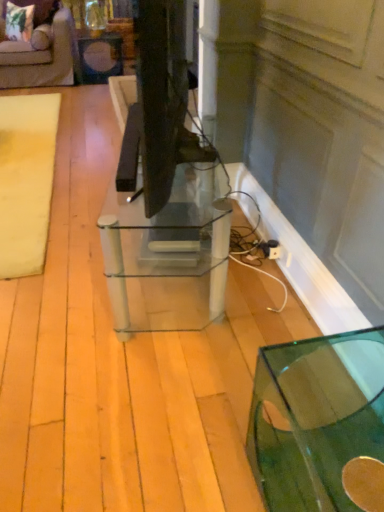
Question: Should I look upward or downward to see matte black side table at upper left?

Choices:
 (A) up
 (B) down

Answer: (A)

Question: Can you confirm if clear glass table at center, the 1th table when ordered from back to front, is wider than transparent glass table at lower right, marked as the 1th table in a front-to-back arrangement?

Choices:
 (A) no
 (B) yes

Answer: (A)

Question: Does clear glass table at center, arranged as the first table when viewed from the left, have a lesser height compared to transparent glass table at lower right, arranged as the 1th table when ordered from the bottom?

Choices:
 (A) yes
 (B) no

Answer: (B)

Question: Can you confirm if clear glass table at center, marked as the second table in a right-to-left arrangement, is positioned to the right of transparent glass table at lower right, arranged as the 1th table when ordered from the bottom?

Choices:
 (A) yes
 (B) no

Answer: (B)

Question: Is the depth of clear glass table at center, which ranks as the first table in top-to-bottom order, greater than that of transparent glass table at lower right, acting as the 2th table starting from the left?

Choices:
 (A) no
 (B) yes

Answer: (B)

Question: From a real-world perspective, is clear glass table at center, the 1th table when ordered from back to front, on transparent glass table at lower right, the 2th table positioned from the top?

Choices:
 (A) no
 (B) yes

Answer: (B)

Question: Is clear glass table at center, arranged as the first table when viewed from the left, aimed at transparent glass table at lower right, acting as the 2th table starting from the left?

Choices:
 (A) yes
 (B) no

Answer: (B)

Question: Considering the relative sizes of clear glass table at center, arranged as the second table when viewed from the front, and velvet beige sofa at upper left in the image provided, is clear glass table at center, arranged as the second table when viewed from the front, thinner than velvet beige sofa at upper left?

Choices:
 (A) no
 (B) yes

Answer: (B)

Question: Can you confirm if clear glass table at center, which ranks as the first table in top-to-bottom order, is wider than velvet beige sofa at upper left?

Choices:
 (A) yes
 (B) no

Answer: (B)

Question: Is velvet beige sofa at upper left at the back of clear glass table at center, which is counted as the second table, starting from the bottom?

Choices:
 (A) yes
 (B) no

Answer: (B)

Question: From the image's perspective, would you say clear glass table at center, arranged as the first table when viewed from the left, is shown under velvet beige sofa at upper left?

Choices:
 (A) yes
 (B) no

Answer: (A)

Question: Is clear glass table at center, marked as the second table in a right-to-left arrangement, not close to velvet beige sofa at upper left?

Choices:
 (A) no
 (B) yes

Answer: (B)

Question: Is clear glass table at center, arranged as the first table when viewed from the left, outside of velvet beige sofa at upper left?

Choices:
 (A) yes
 (B) no

Answer: (A)

Question: Does beige fabric mat at left have a smaller size compared to matte black side table at upper left?

Choices:
 (A) no
 (B) yes

Answer: (B)